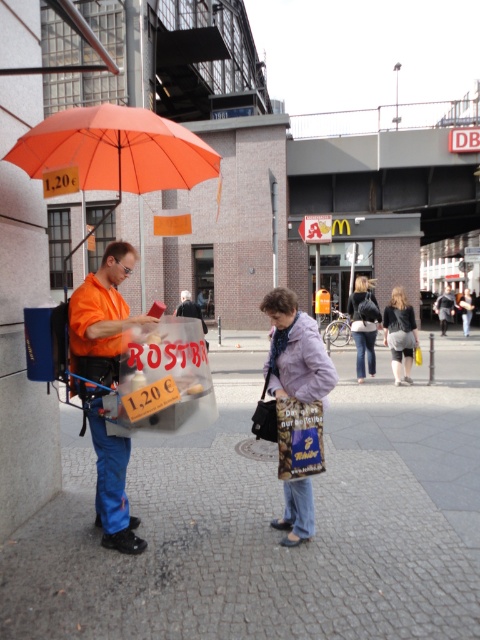
Question: Is dark gray fabric pants at center positioned before dark gray fabric jacket at center?

Choices:
 (A) no
 (B) yes

Answer: (B)

Question: Is cobblestone pavement at center closer to camera compared to leather jacket at center?

Choices:
 (A) yes
 (B) no

Answer: (A)

Question: Which object is farther from the camera taking this photo?

Choices:
 (A) cobblestone pavement at center
 (B) leather jacket at center
 (C) dark gray fabric jacket at center
 (D) dark gray fabric pants at center

Answer: (C)

Question: Which of these objects is positioned farthest from the dark gray fabric pants at center?

Choices:
 (A) denim jacket at center
 (B) orange fabric umbrella at left
 (C) orange fabric umbrella at upper left
 (D) cobblestone pavement at center

Answer: (C)

Question: Can you confirm if cobblestone pavement at center is positioned below orange matte umbrella at left?

Choices:
 (A) no
 (B) yes

Answer: (B)

Question: Which object is closer to the camera taking this photo?

Choices:
 (A) orange matte umbrella at left
 (B) dark gray fabric jacket at center
 (C) leather jacket at center

Answer: (A)